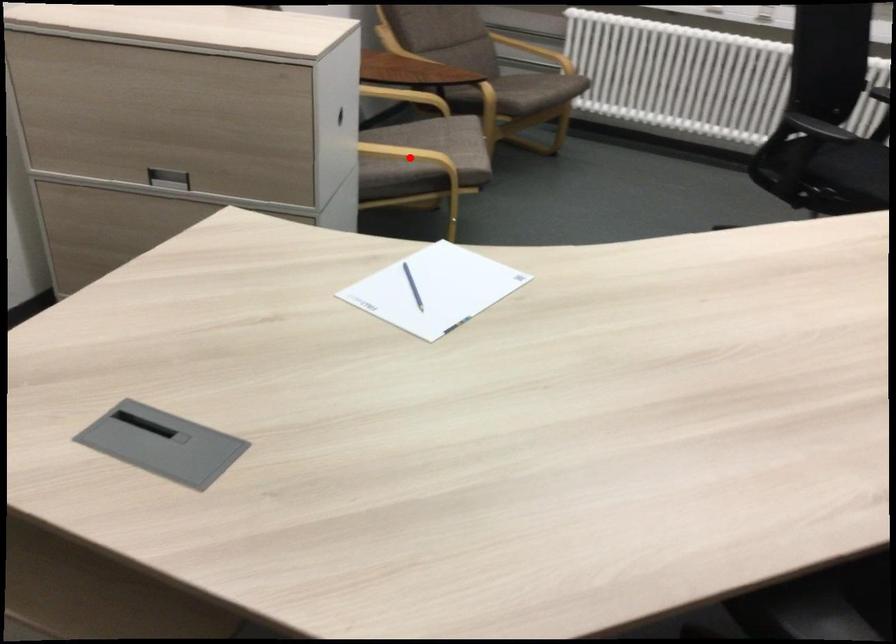
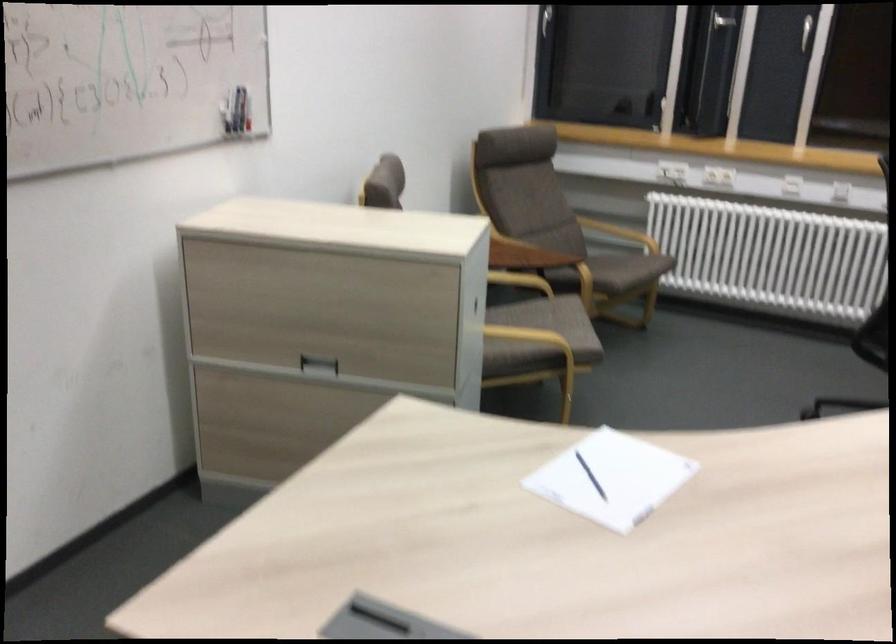
Where in the second image is the point corresponding to the highlighted location from the first image?

(528, 336)